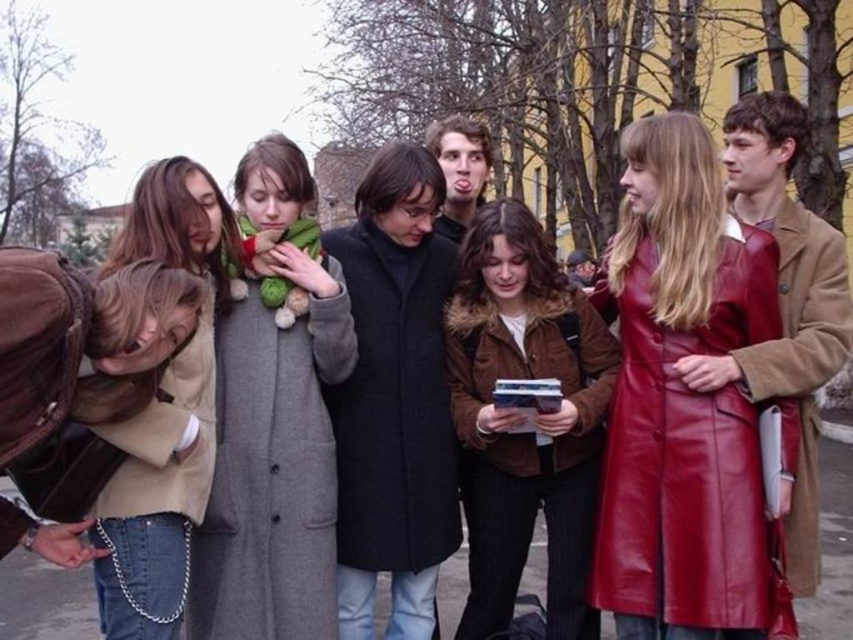
Question: Which object is farther from the camera taking this photo?

Choices:
 (A) dark gray wool coat at center
 (B) leather coat at right
 (C) smooth brown coat at center
 (D) gray wool coat at center

Answer: (C)

Question: Does dark gray wool coat at center appear on the right side of smooth brown coat at center?

Choices:
 (A) yes
 (B) no

Answer: (B)

Question: Does dark gray wool coat at center come in front of light brown suede jacket at left?

Choices:
 (A) no
 (B) yes

Answer: (A)

Question: Considering the real-world distances, which object is farthest from the brown leather jacket at center?

Choices:
 (A) smooth brown coat at center
 (B) light brown suede jacket at left
 (C) dark gray wool coat at center

Answer: (B)

Question: Is brown leather jacket at center thinner than smooth brown coat at center?

Choices:
 (A) yes
 (B) no

Answer: (B)

Question: Considering the real-world distances, which object is closest to the dark gray wool coat at center?

Choices:
 (A) light brown suede jacket at left
 (B) smooth brown coat at center

Answer: (A)